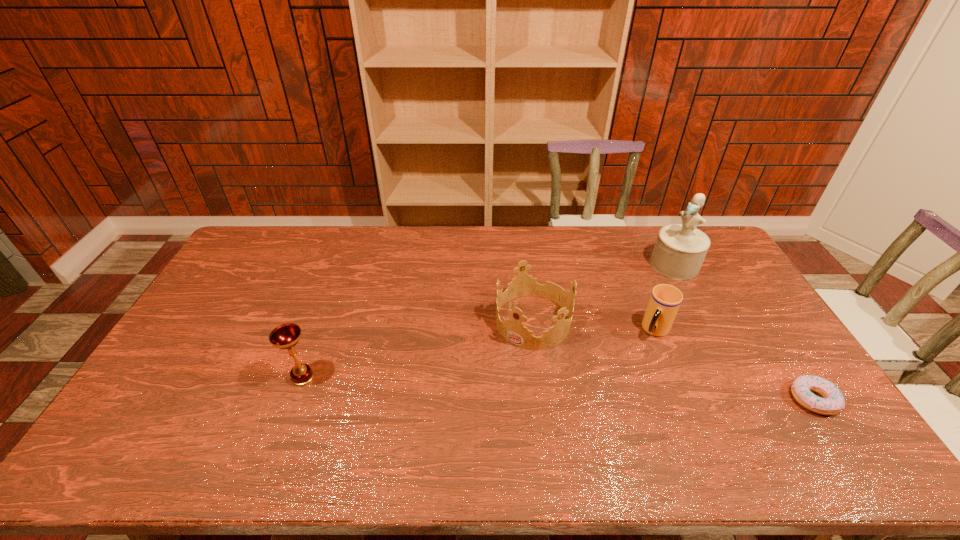
The width and height of the screenshot is (960, 540). What are the coordinates of `object that is the nearest to the tallest object` in the screenshot? It's located at (665, 300).

Identify which object is the second closest to the tiara. Please provide its 2D coordinates. Your answer should be formatted as a tuple, i.e. [(x, y)], where the tuple contains the x and y coordinates of a point satisfying the conditions above.

[(680, 249)]

At what (x,y) coordinates should I click in order to perform the action: click on free space in the image that satisfies the following two spatial constraints: 1. on the back side of the chalice; 2. on the right side of the fourth object from left to right. Please return your answer as a coordinate pair (x, y). Looking at the image, I should click on (344, 265).

Identify the location of free location that satisfies the following two spatial constraints: 1. on the front side of the chalice; 2. on the left side of the rightmost object. Image resolution: width=960 pixels, height=540 pixels. (296, 399).

Where is `free spot that satisfies the following two spatial constraints: 1. on the front side of the tiara; 2. on the left side of the shortest object`? The image size is (960, 540). free spot that satisfies the following two spatial constraints: 1. on the front side of the tiara; 2. on the left side of the shortest object is located at coordinates (542, 399).

I want to click on vacant region that satisfies the following two spatial constraints: 1. on the front side of the fourth object from right to left; 2. on the right side of the shortest object, so click(542, 399).